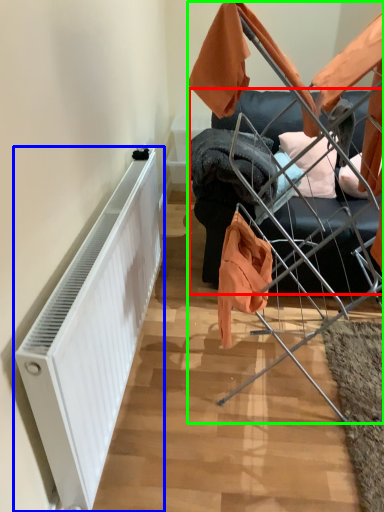
Question: Which is farther away from furniture (highlighted by a red box)? radiator (highlighted by a blue box) or baby carriage (highlighted by a green box)?

Choices:
 (A) radiator
 (B) baby carriage

Answer: (A)